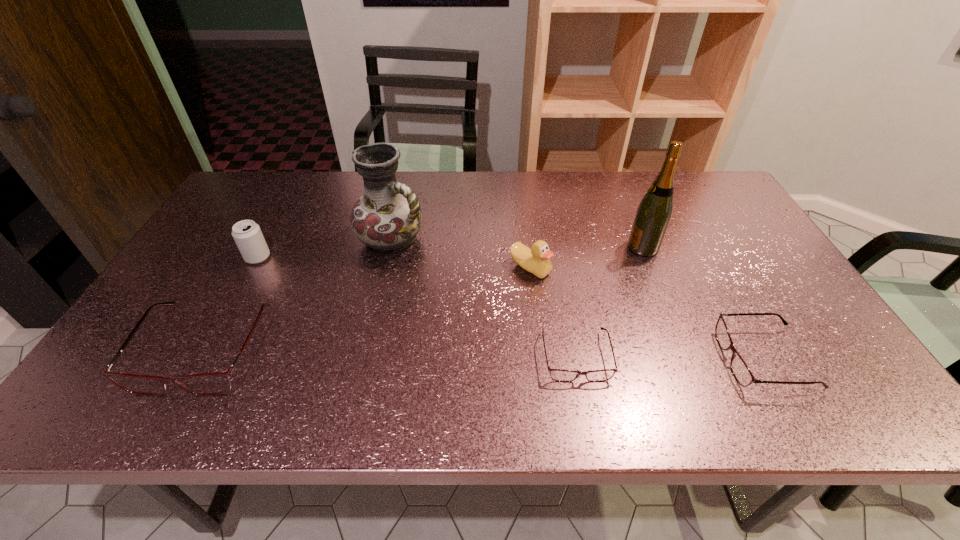
I want to click on vacant point located between the duck and the second tallest spectacles, so click(647, 314).

The width and height of the screenshot is (960, 540). Find the location of `free spot between the fifth object from right to left and the second spectacles from right to left`. free spot between the fifth object from right to left and the second spectacles from right to left is located at coordinates (484, 298).

Where is `free spot between the sixth object from left to right and the leftmost spectacles`? Image resolution: width=960 pixels, height=540 pixels. free spot between the sixth object from left to right and the leftmost spectacles is located at coordinates (424, 298).

Where is `free space that is in between the duck and the shortest object`? This screenshot has height=540, width=960. free space that is in between the duck and the shortest object is located at coordinates (553, 312).

I want to click on free space between the tallest spectacles and the shortest spectacles, so click(391, 352).

Find the location of a particular element. The width and height of the screenshot is (960, 540). blank region between the third object from left to right and the tallest spectacles is located at coordinates (299, 294).

Identify the location of blank region between the duck and the second tallest spectacles. (647, 314).

Image resolution: width=960 pixels, height=540 pixels. In order to click on vacant area between the second spectacles from right to left and the wine bottle in this screenshot , I will do `click(610, 301)`.

Point out which object is positioned as the sixth nearest to the sixth shortest object. Please provide its 2D coordinates. Your answer should be formatted as a tuple, i.e. [(x, y)], where the tuple contains the x and y coordinates of a point satisfying the conditions above.

[(740, 370)]

Select which object appears as the closest to the sixth shortest object. Please provide its 2D coordinates. Your answer should be formatted as a tuple, i.e. [(x, y)], where the tuple contains the x and y coordinates of a point satisfying the conditions above.

[(207, 384)]